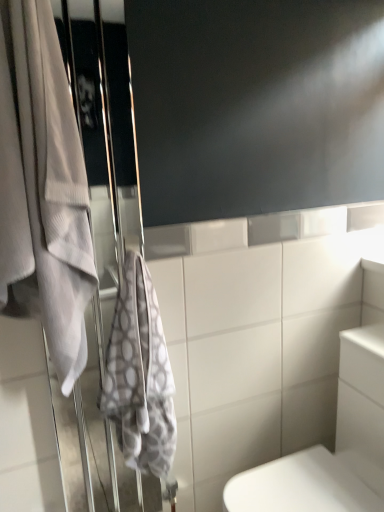
Locate an element on the screen. The height and width of the screenshot is (512, 384). white fabric screen door at left is located at coordinates point(61,246).

Image resolution: width=384 pixels, height=512 pixels. What are the coordinates of `white textured towel at left, arranged as the 2th towel when viewed from the right` in the screenshot? It's located at (43, 187).

What do you see at coordinates (43, 187) in the screenshot? I see `white textured towel at left, the 1th towel when ordered from left to right` at bounding box center [43, 187].

This screenshot has width=384, height=512. Find the location of `gray textured towel at left, marked as the first towel in a right-to-left arrangement`. gray textured towel at left, marked as the first towel in a right-to-left arrangement is located at coordinates (140, 375).

From the image's perspective, is white fabric screen door at left beneath white textured towel at left, the 1th towel when ordered from left to right?

Yes, from the image's perspective, white fabric screen door at left is below white textured towel at left, the 1th towel when ordered from left to right.

There is a white fabric screen door at left. Identify the location of towel above it (from a real-world perspective). Image resolution: width=384 pixels, height=512 pixels. tap(43, 187).

Which of these two, white fabric screen door at left or white textured towel at left, arranged as the 2th towel when viewed from the right, is thinner?

white fabric screen door at left is thinner.

Is white textured towel at left, arranged as the 2th towel when viewed from the right, shorter than white glossy toilet at lower right?

No, white textured towel at left, arranged as the 2th towel when viewed from the right, is not shorter than white glossy toilet at lower right.

Considering the points (23, 237) and (377, 444), which point is behind, point (23, 237) or point (377, 444)?

The point (377, 444) is more distant.

Between white textured towel at left, the 1th towel when ordered from left to right, and white glossy toilet at lower right, which one has smaller size?

Smaller between the two is white textured towel at left, the 1th towel when ordered from left to right.

From the image's perspective, between white textured towel at left, arranged as the 2th towel when viewed from the right, and white glossy toilet at lower right, who is located below?

white glossy toilet at lower right appears lower in the image.

Consider the image. Is gray textured towel at left, marked as the first towel in a right-to-left arrangement, shorter than white glossy toilet at lower right?

Yes.

Between gray textured towel at left, marked as the first towel in a right-to-left arrangement, and white glossy toilet at lower right, which one has smaller width?

gray textured towel at left, marked as the first towel in a right-to-left arrangement, is thinner.

How much distance is there between gray textured towel at left, marked as the first towel in a right-to-left arrangement, and white glossy toilet at lower right?

A distance of 19.29 inches exists between gray textured towel at left, marked as the first towel in a right-to-left arrangement, and white glossy toilet at lower right.

Which object is positioned more to the left, gray textured towel at left, marked as the first towel in a right-to-left arrangement, or white glossy toilet at lower right?

gray textured towel at left, marked as the first towel in a right-to-left arrangement.

Which object is wider, white textured towel at left, arranged as the 2th towel when viewed from the right, or white fabric screen door at left?

white textured towel at left, arranged as the 2th towel when viewed from the right.

Can you see white textured towel at left, the 1th towel when ordered from left to right, touching white fabric screen door at left?

No, white textured towel at left, the 1th towel when ordered from left to right, is not next to white fabric screen door at left.

From the image's perspective, does white textured towel at left, arranged as the 2th towel when viewed from the right, appear higher than gray textured towel at left, which is the second towel from left to right?

Yes, from the image's perspective, white textured towel at left, arranged as the 2th towel when viewed from the right, is above gray textured towel at left, which is the second towel from left to right.

Identify the location of towel that appears below the white textured towel at left, arranged as the 2th towel when viewed from the right (from the image's perspective). (140, 375).

Is point (46, 150) farther from camera compared to point (160, 418)?

No, (46, 150) is in front of (160, 418).

Is white textured towel at left, arranged as the 2th towel when viewed from the right, behind gray textured towel at left, which is the second towel from left to right?

That is False.

Measure the distance from white fabric screen door at left to gray textured towel at left, which is the second towel from left to right.

white fabric screen door at left is 9.55 inches away from gray textured towel at left, which is the second towel from left to right.

Which object is thinner, white fabric screen door at left or gray textured towel at left, marked as the first towel in a right-to-left arrangement?

white fabric screen door at left is thinner.

From the image's perspective, is white fabric screen door at left on gray textured towel at left, which is the second towel from left to right?

Correct, white fabric screen door at left appears higher than gray textured towel at left, which is the second towel from left to right, in the image.

Is white fabric screen door at left aimed at gray textured towel at left, which is the second towel from left to right?

Yes, white fabric screen door at left is oriented towards gray textured towel at left, which is the second towel from left to right.

Which object is positioned more to the left, gray textured towel at left, which is the second towel from left to right, or white fabric screen door at left?

Positioned to the left is white fabric screen door at left.

Looking at the image, does gray textured towel at left, marked as the first towel in a right-to-left arrangement, seem bigger or smaller compared to white fabric screen door at left?

gray textured towel at left, marked as the first towel in a right-to-left arrangement, is smaller than white fabric screen door at left.

Can you confirm if gray textured towel at left, which is the second towel from left to right, is thinner than white fabric screen door at left?

Incorrect, the width of gray textured towel at left, which is the second towel from left to right, is not less than that of white fabric screen door at left.

Looking at this image, could you measure the distance between gray textured towel at left, which is the second towel from left to right, and white fabric screen door at left?

A distance of 24.25 centimeters exists between gray textured towel at left, which is the second towel from left to right, and white fabric screen door at left.

Identify the location of towel that is above the white fabric screen door at left (from a real-world perspective). Image resolution: width=384 pixels, height=512 pixels. (43, 187).

In the image, there is a white textured towel at left, arranged as the 2th towel when viewed from the right. Identify the location of bath below it (from a real-world perspective). The width and height of the screenshot is (384, 512). (335, 448).

Based on their spatial positions, is white glossy toilet at lower right or white textured towel at left, the 1th towel when ordered from left to right, closer to white fabric screen door at left?

Based on the image, white textured towel at left, the 1th towel when ordered from left to right, appears to be nearer to white fabric screen door at left.

Considering their positions, is gray textured towel at left, which is the second towel from left to right, positioned further to white glossy toilet at lower right than white fabric screen door at left?

Among the two, white fabric screen door at left is located further to white glossy toilet at lower right.

Which object lies nearer to the anchor point white glossy toilet at lower right, white textured towel at left, arranged as the 2th towel when viewed from the right, or white fabric screen door at left?

Based on the image, white fabric screen door at left appears to be nearer to white glossy toilet at lower right.

Which object lies nearer to the anchor point gray textured towel at left, which is the second towel from left to right, white textured towel at left, the 1th towel when ordered from left to right, or white glossy toilet at lower right?

The object closer to gray textured towel at left, which is the second towel from left to right, is white textured towel at left, the 1th towel when ordered from left to right.

When comparing their distances from white glossy toilet at lower right, does gray textured towel at left, which is the second towel from left to right, or white textured towel at left, the 1th towel when ordered from left to right, seem further?

Based on the image, white textured towel at left, the 1th towel when ordered from left to right, appears to be further to white glossy toilet at lower right.

From the image, which object appears to be farther from gray textured towel at left, which is the second towel from left to right, white fabric screen door at left or white textured towel at left, the 1th towel when ordered from left to right?

white textured towel at left, the 1th towel when ordered from left to right, lies further to gray textured towel at left, which is the second towel from left to right, than the other object.

Which object lies further to the anchor point white fabric screen door at left, white textured towel at left, the 1th towel when ordered from left to right, or gray textured towel at left, which is the second towel from left to right?

Based on the image, gray textured towel at left, which is the second towel from left to right, appears to be further to white fabric screen door at left.

Based on their spatial positions, is gray textured towel at left, which is the second towel from left to right, or white glossy toilet at lower right closer to white fabric screen door at left?

gray textured towel at left, which is the second towel from left to right, lies closer to white fabric screen door at left than the other object.

Where is `towel between white fabric screen door at left and white glossy toilet at lower right from left to right`? This screenshot has width=384, height=512. towel between white fabric screen door at left and white glossy toilet at lower right from left to right is located at coordinates (140, 375).

In order to click on screen door between white textured towel at left, the 1th towel when ordered from left to right, and gray textured towel at left, marked as the first towel in a right-to-left arrangement, vertically in this screenshot , I will do `click(61, 246)`.

At what (x,y) coordinates should I click in order to perform the action: click on screen door between white textured towel at left, the 1th towel when ordered from left to right, and white glossy toilet at lower right, in the horizontal direction. Please return your answer as a coordinate pair (x, y). Looking at the image, I should click on (61, 246).

Locate an element on the screen. towel between white textured towel at left, the 1th towel when ordered from left to right, and white glossy toilet at lower right from left to right is located at coordinates (140, 375).